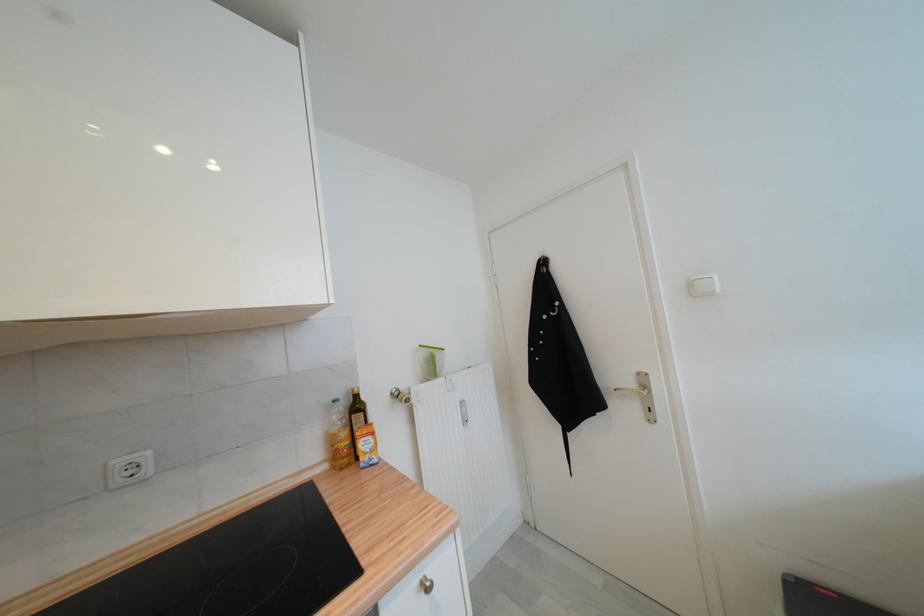
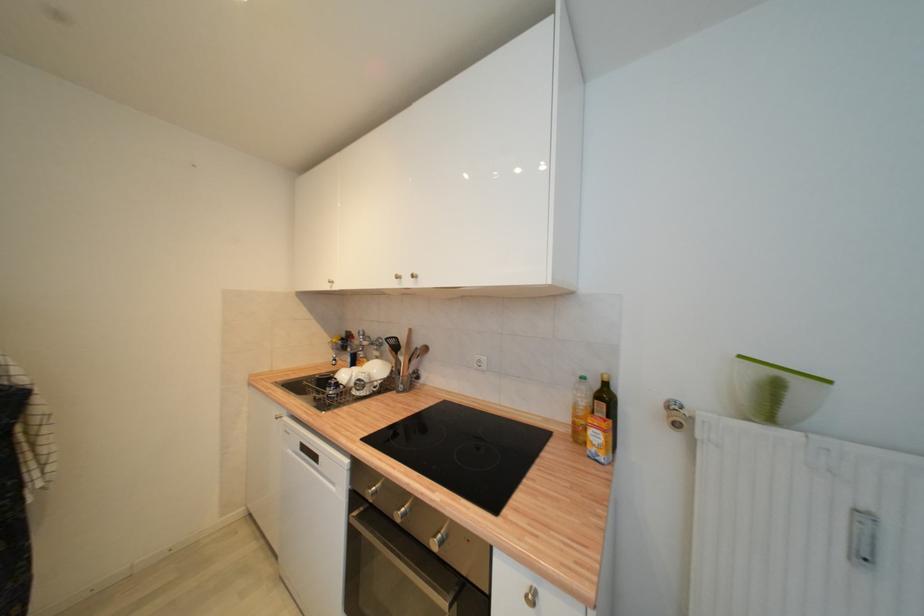
Question: The images are taken continuously from a first-person perspective. In which direction is your viewpoint rotating?

Choices:
 (A) Left
 (B) Right
 (C) Up
 (D) Down

Answer: (A)